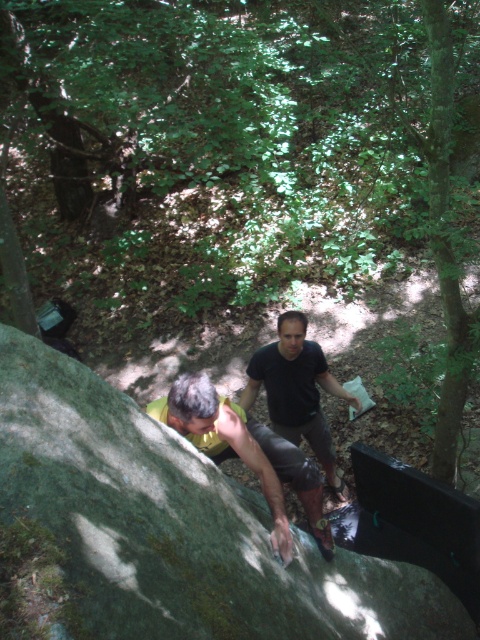
Who is positioned more to the right, green mossy rock at center or green mossy rock at lower left?

green mossy rock at center

Who is lower down, green mossy rock at center or green mossy rock at lower left?

green mossy rock at center is below.

Is point (332, 627) less distant than point (254, 458)?

That is True.

Where is `green mossy rock at center`? This screenshot has height=640, width=480. green mossy rock at center is located at coordinates (179, 525).

Which is below, green mossy rock at lower left or black matte shirt at center?

Positioned lower is green mossy rock at lower left.

How much distance is there between green mossy rock at lower left and black matte shirt at center?

green mossy rock at lower left and black matte shirt at center are 3.93 feet apart from each other.

The image size is (480, 640). What are the coordinates of `green mossy rock at lower left` in the screenshot? It's located at (247, 452).

Where is `green mossy rock at lower left`? green mossy rock at lower left is located at coordinates (247, 452).

Is green mossy rock at center positioned in front of black matte shirt at center?

Yes, green mossy rock at center is in front of black matte shirt at center.

Between point (44, 416) and point (325, 364), which one is positioned behind?

Point (325, 364)

Where is `green mossy rock at center`? This screenshot has height=640, width=480. green mossy rock at center is located at coordinates (179, 525).